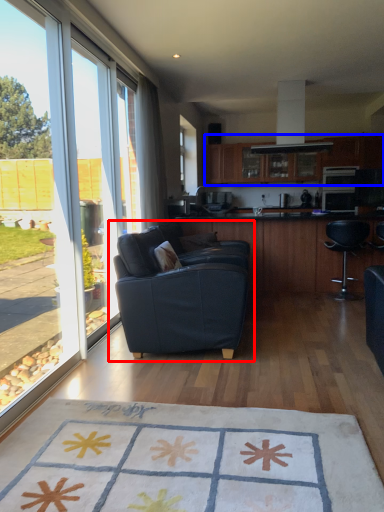
Question: Which object is further to the camera taking this photo, studio couch (highlighted by a red box) or cabinetry (highlighted by a blue box)?

Choices:
 (A) studio couch
 (B) cabinetry

Answer: (B)